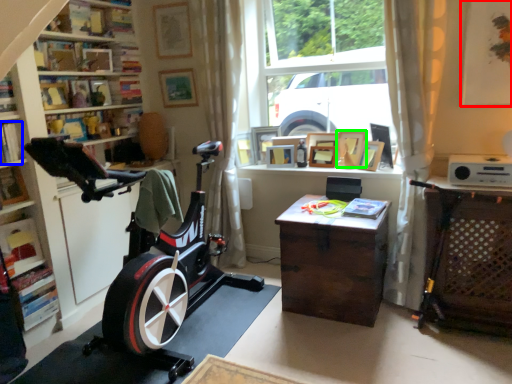
Question: Which object is positioned closest to picture frame (highlighted by a red box)? Select from book (highlighted by a blue box) and picture frame (highlighted by a green box).

Choices:
 (A) book
 (B) picture frame

Answer: (B)